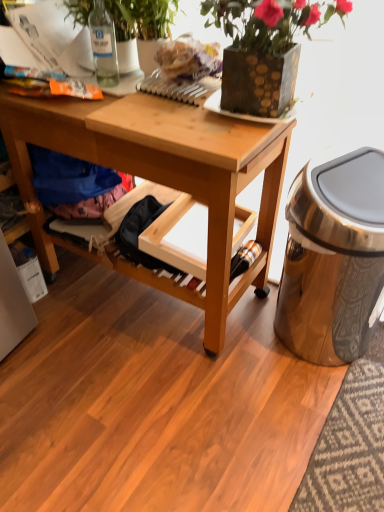
The image size is (384, 512). Identify the location of empty space that is in between wooden desk at center and polished metallic trash can at right. (272, 375).